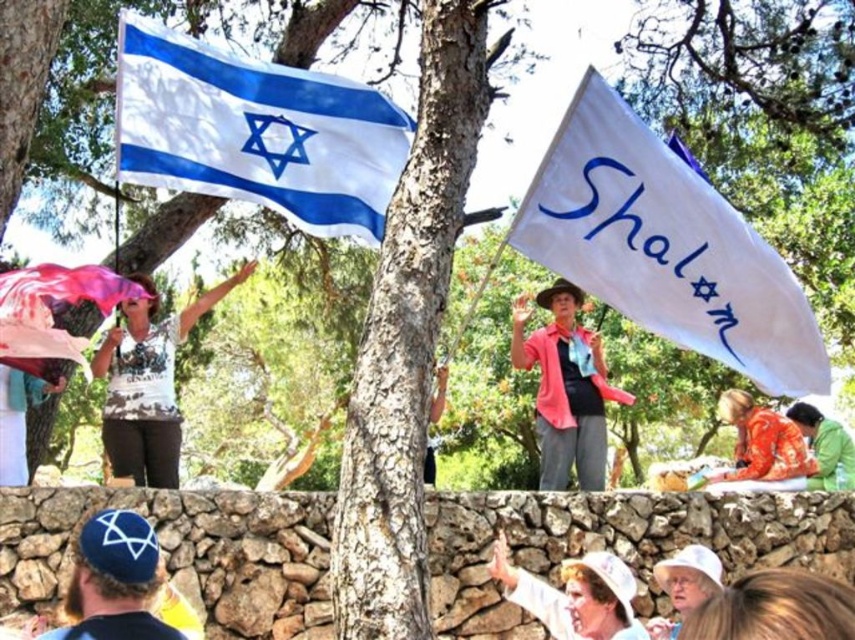
Question: Which point is closer to the camera?

Choices:
 (A) click(x=370, y=164)
 (B) click(x=140, y=323)
 (C) click(x=122, y=541)
 (D) click(x=727, y=228)

Answer: (C)

Question: Which point is closer to the camera?

Choices:
 (A) [x=770, y=461]
 (B) [x=765, y=328]
 (C) [x=590, y=477]
 (D) [x=830, y=474]

Answer: (B)

Question: Can you confirm if pink fabric at center is smaller than orange fabric at lower right?

Choices:
 (A) yes
 (B) no

Answer: (B)

Question: Can you confirm if white matte shirt at upper left is positioned to the right of orange fabric at lower right?

Choices:
 (A) no
 (B) yes

Answer: (A)

Question: Which point is farther from the camera taking this photo?

Choices:
 (A) (108, 346)
 (B) (743, 433)

Answer: (B)

Question: Can you confirm if white fabric flag at center is bigger than green fabric at lower right?

Choices:
 (A) no
 (B) yes

Answer: (B)